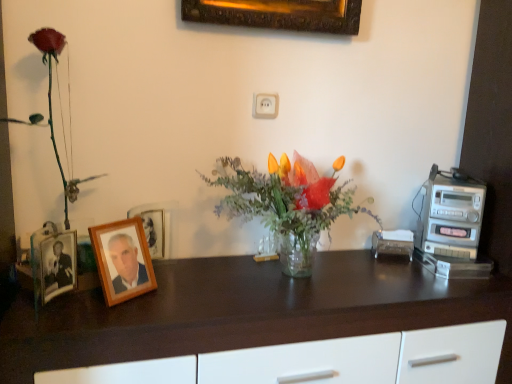
What are the coordinates of `free area in between clear glass vase at center and wooden picture frame at left, acting as the second picture frame starting from the front` in the screenshot? It's located at (187, 281).